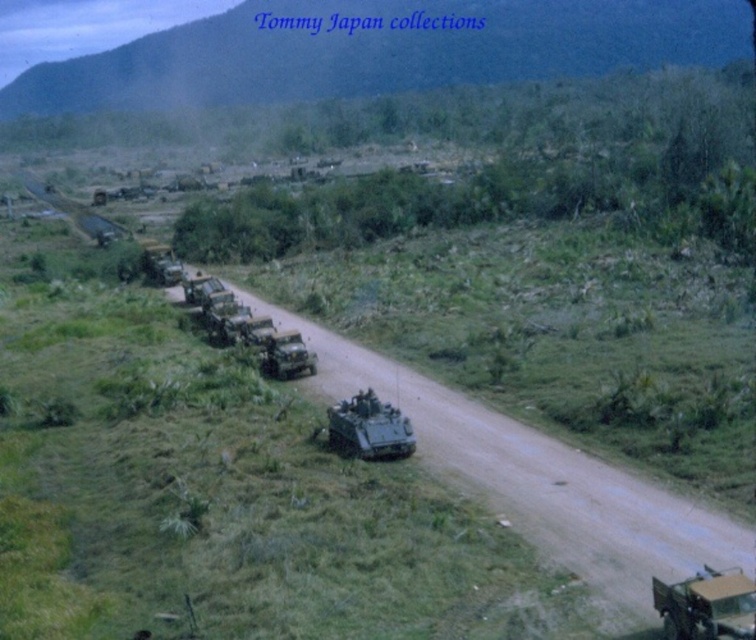
You are a military commander observing the convoy. You need to determine the order of the vehicles for a report. Which vehicle is positioned ahead in the convoy between the camouflage fabric jeep at center and the matte green tank at center?

The camouflage fabric jeep at center is positioned ahead of the matte green tank at center in the convoy.

You are a military planner assessing the convoy layout. The camouflage fabric jeep at center and the matte green tank at center are both positioned at the center of the road. Which vehicle should be placed first in the convoy to ensure the smaller vehicle can follow closely behind without getting stuck?

The camouflage fabric jeep at center should be placed first in the convoy because it is smaller compared to the matte green tank at center, allowing it to navigate the terrain more easily and create a path for the larger vehicle to follow.